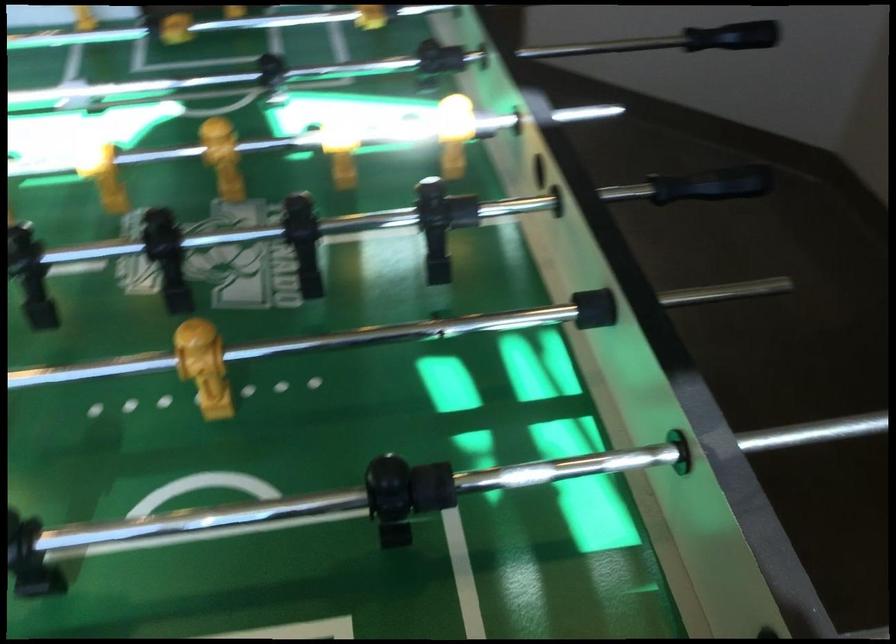
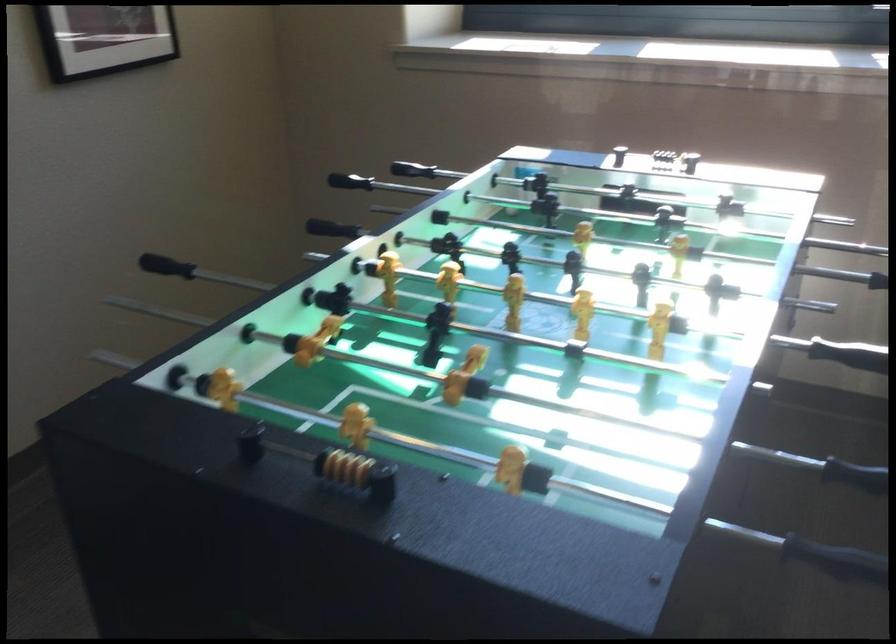
Where in the second image is the point corresponding to point 711,184 from the first image?

(304, 236)